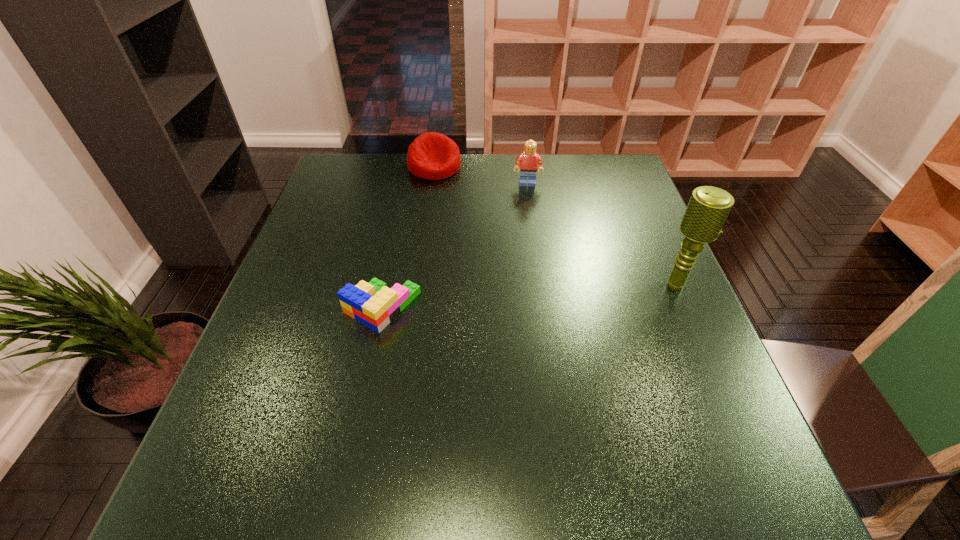
Locate an element on the screen. The width and height of the screenshot is (960, 540). the shortest object is located at coordinates (373, 304).

Locate an element on the screen. the shorter Lego is located at coordinates (373, 304).

At what (x,y) coordinates should I click in order to perform the action: click on the rightmost object. Please return your answer as a coordinate pair (x, y). The width and height of the screenshot is (960, 540). Looking at the image, I should click on (708, 208).

The height and width of the screenshot is (540, 960). Identify the location of microphone. (708, 208).

You are a GUI agent. You are given a task and a screenshot of the screen. Output one action in this format:
    pyautogui.click(x=<x>, y=<y>)
    Task: Click on the right Lego
    The image size is (960, 540).
    Given the screenshot: What is the action you would take?
    pyautogui.click(x=529, y=160)

Locate an element on the screen. the third shortest object is located at coordinates (529, 160).

The height and width of the screenshot is (540, 960). I want to click on beanbag, so click(x=432, y=156).

I want to click on free space located 0.290m on the right of the nearer Lego, so click(x=551, y=307).

In order to click on vacant space located on the front of the tallest object in this screenshot , I will do `click(707, 355)`.

Where is `free space located 0.380m on the front-facing side of the taller Lego`? This screenshot has width=960, height=540. free space located 0.380m on the front-facing side of the taller Lego is located at coordinates (529, 278).